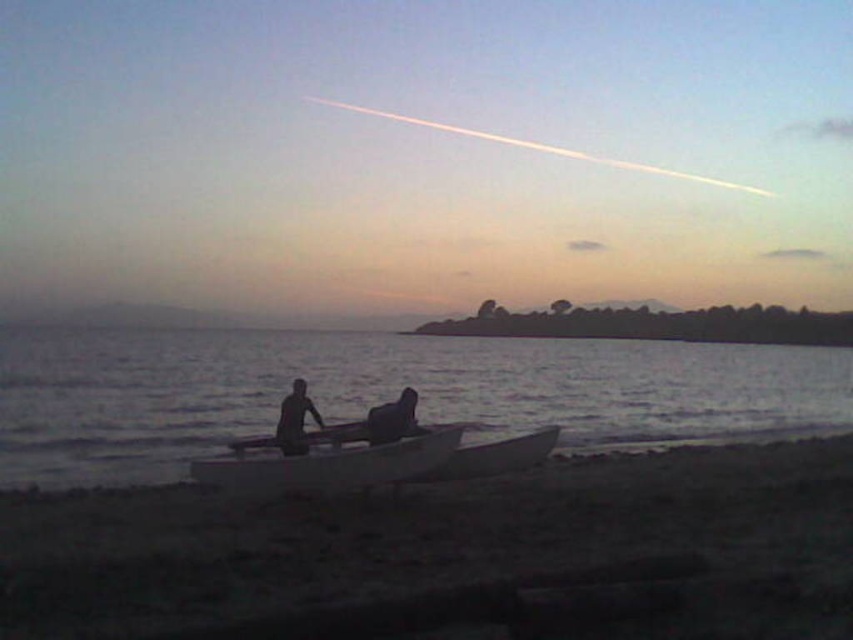
Based on the photo, you are standing in the coastal scene and want to place a small flag at the point that is closer to you. Which point should you choose between point (373,416) and point (299,417)?

Point (373,416) is closer to the camera than point (299,417), so you should choose point (373,416) to place the flag.

You are a photographer trying to capture the silhouette skin couple at center in the scene. Based on their position coordinates, where exactly should you aim your camera to ensure they are centered in the frame?

To center the silhouette skin couple at center in the frame, aim your camera at the coordinates point (294,420).